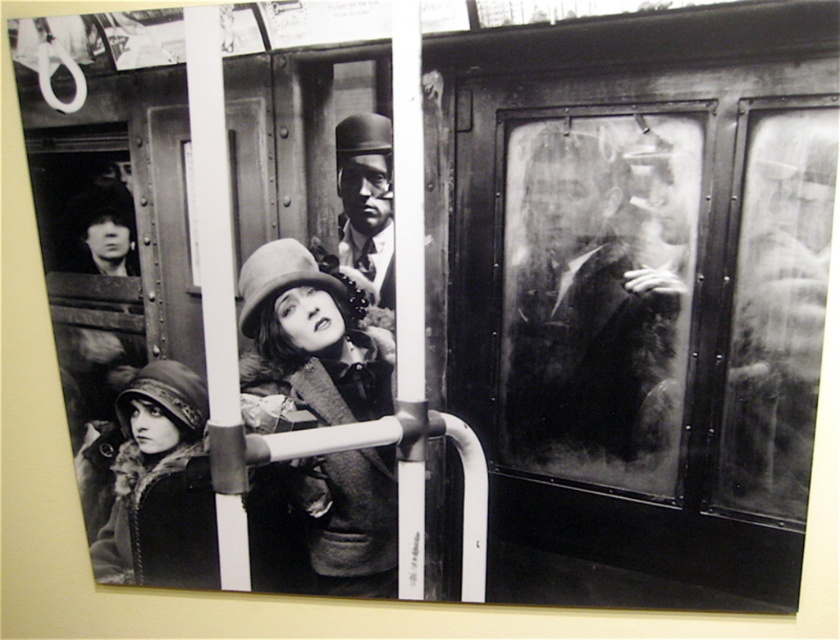
Between fuzzy felt hat at center and fur-lined coat at lower left, which one is positioned higher?

fuzzy felt hat at center is above.

Is fuzzy felt hat at center shorter than fur-lined coat at lower left?

Incorrect, fuzzy felt hat at center's height does not fall short of fur-lined coat at lower left's.

Where is `fuzzy felt hat at center`? The width and height of the screenshot is (840, 640). fuzzy felt hat at center is located at coordinates (311, 339).

Who is more forward, [549,412] or [176,448]?

Point [549,412] is in front.

Is smooth black coat at right to the right of fur-lined coat at lower left from the viewer's perspective?

Yes, smooth black coat at right is to the right of fur-lined coat at lower left.

Is point (573, 346) positioned before point (176, 572)?

Yes, it is in front of point (176, 572).

This screenshot has width=840, height=640. In order to click on smooth black coat at right in this screenshot , I will do `click(588, 310)`.

Is point (594, 186) positioned before point (311, 520)?

That is True.

Is smooth black coat at right bigger than fuzzy felt hat at center?

Indeed, smooth black coat at right has a larger size compared to fuzzy felt hat at center.

Which is behind, point (680, 296) or point (371, 296)?

Point (371, 296)

At what (x,y) coordinates should I click in order to perform the action: click on smooth black coat at right. Please return your answer as a coordinate pair (x, y). The height and width of the screenshot is (640, 840). Looking at the image, I should click on (588, 310).